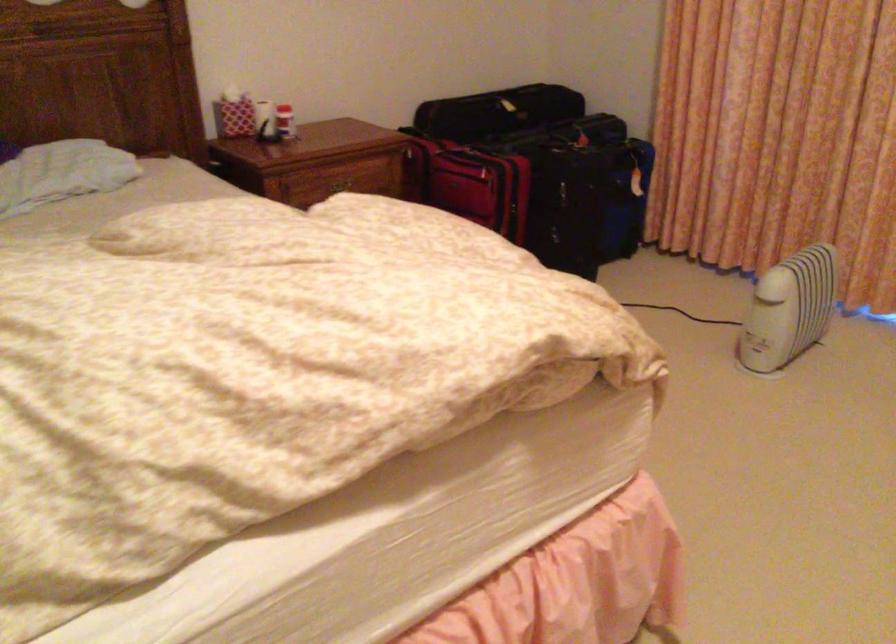
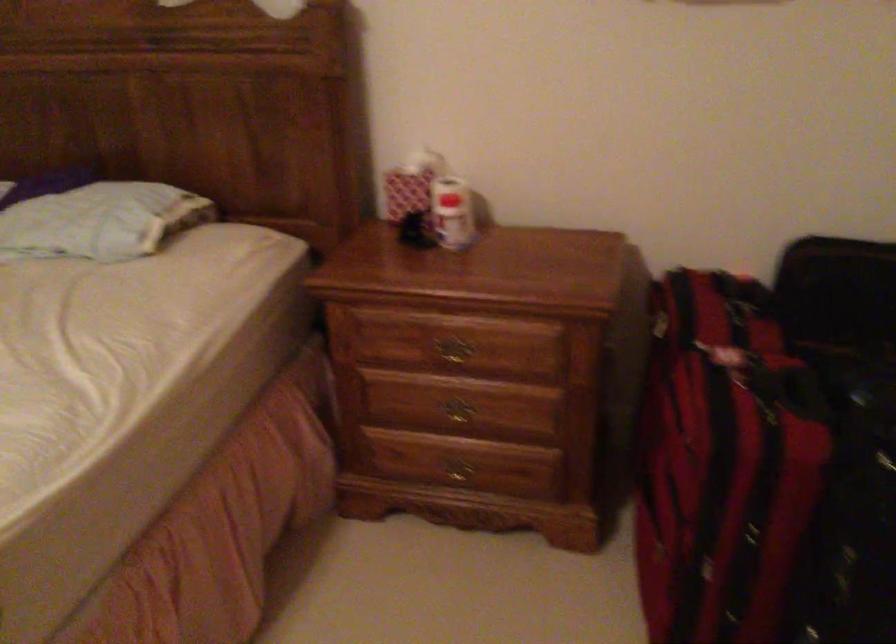
Locate, in the second image, the point that corresponds to (x=234, y=111) in the first image.

(410, 184)